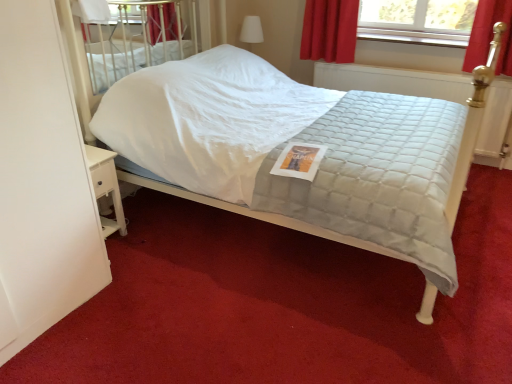
Question: Is white wood nightstand at lower left turned away from white quilted fabric bed at center?

Choices:
 (A) no
 (B) yes

Answer: (A)

Question: Is white wood nightstand at lower left positioned beyond the bounds of white quilted fabric bed at center?

Choices:
 (A) yes
 (B) no

Answer: (A)

Question: Can you confirm if white wood nightstand at lower left is positioned to the left of white quilted fabric bed at center?

Choices:
 (A) no
 (B) yes

Answer: (B)

Question: From the image's perspective, is white wood nightstand at lower left on white quilted fabric bed at center?

Choices:
 (A) yes
 (B) no

Answer: (B)

Question: From a real-world perspective, is white wood nightstand at lower left physically above white quilted fabric bed at center?

Choices:
 (A) no
 (B) yes

Answer: (A)

Question: Does white wood nightstand at lower left lie in front of white quilted fabric bed at center?

Choices:
 (A) yes
 (B) no

Answer: (B)

Question: Does white wood nightstand at lower left appear on the right side of white matte screen door at left?

Choices:
 (A) no
 (B) yes

Answer: (B)

Question: Is white wood nightstand at lower left shorter than white matte screen door at left?

Choices:
 (A) no
 (B) yes

Answer: (B)

Question: Is the position of white wood nightstand at lower left less distant than that of white matte screen door at left?

Choices:
 (A) no
 (B) yes

Answer: (A)

Question: Is white wood nightstand at lower left not within white matte screen door at left?

Choices:
 (A) yes
 (B) no

Answer: (A)

Question: Can you confirm if white wood nightstand at lower left is thinner than white matte screen door at left?

Choices:
 (A) no
 (B) yes

Answer: (B)

Question: Is white matte screen door at left inside white wood nightstand at lower left?

Choices:
 (A) yes
 (B) no

Answer: (B)

Question: From a real-world perspective, is white quilted fabric bed at center on white matte screen door at left?

Choices:
 (A) yes
 (B) no

Answer: (A)